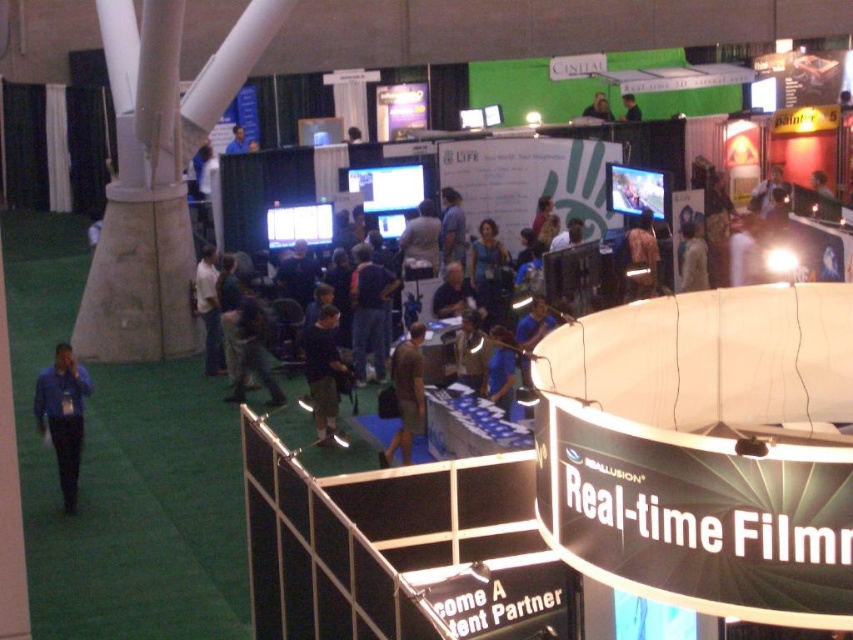
Is khaki shorts at center positioned before dark blue shirt at upper center?

That is True.

Is point (306, 365) more distant than point (635, 112)?

No, (306, 365) is in front of (635, 112).

Locate an element on the screen. khaki shorts at center is located at coordinates tap(323, 371).

Which is above, khaki shorts at center or blue shirt at center?

blue shirt at center

Is khaki shorts at center positioned before blue shirt at center?

Yes, it is.

Between point (312, 396) and point (445, 204), which one is positioned behind?

The point (445, 204) is more distant.

Image resolution: width=853 pixels, height=640 pixels. I want to click on khaki shorts at center, so [x=323, y=371].

Is brown fabric shirt at center smaller than dark blue shirt at upper center?

Actually, brown fabric shirt at center might be larger than dark blue shirt at upper center.

Looking at this image, is brown fabric shirt at center to the left of dark blue shirt at upper center from the viewer's perspective?

Yes, brown fabric shirt at center is to the left of dark blue shirt at upper center.

Measure the distance between point [393,355] and camera.

They are 27.17 meters apart.

The image size is (853, 640). What are the coordinates of `brown fabric shirt at center` in the screenshot? It's located at (405, 394).